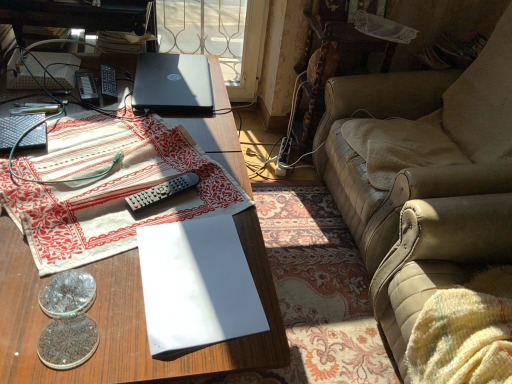
Question: Considering the positions of gray plastic remote at center, acting as the first remote control starting from the front, and wooden desk at center in the image, is gray plastic remote at center, acting as the first remote control starting from the front, taller or shorter than wooden desk at center?

Choices:
 (A) tall
 (B) short

Answer: (B)

Question: Do you think gray plastic remote at center, placed as the first remote control when sorted from bottom to top, is within wooden desk at center, or outside of it?

Choices:
 (A) outside
 (B) inside

Answer: (A)

Question: Which is nearer to the black plastic remote control at center, which is the third remote control in bottom-to-top order?

Choices:
 (A) white cotton tablecloth at left
 (B) leather couch at right
 (C) wooden desk at center
 (D) gray plastic remote at center, the 3th remote control viewed from the back
 (E) shiny metallic coin at lower left, placed as the 1th coin when sorted from back to front

Answer: (A)

Question: Considering the real-world distances, which object is farthest from the shiny metallic coin at lower left, placed as the second coin when sorted from front to back?

Choices:
 (A) black plastic remote control at center, which ranks as the 2th remote control in left-to-right order
 (B) white cotton tablecloth at left
 (C) black plastic remote control at upper left, the 3th remote control from the right
 (D) gray plastic remote at center, acting as the first remote control starting from the front
 (E) translucent glass coins at lower left, the first coin viewed from the front

Answer: (A)